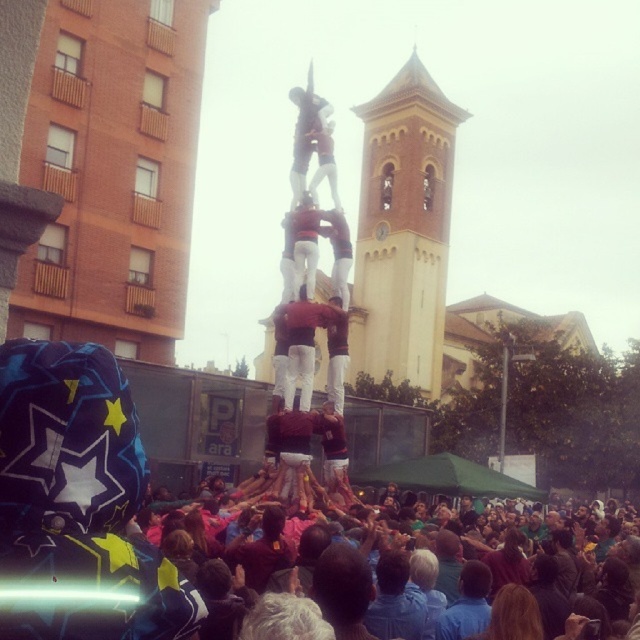
You are a photographer standing in the middle of the scene. You want to take a photo of the yellow brick tower at upper center without the dark blue fabric crowd at lower center blocking it. Which direction should you move to ensure the crowd is out of the frame?

You should move to the right to position yourself so that the dark blue fabric crowd at lower center is no longer blocking the view of the yellow brick tower at upper center, as the crowd is located to the left of the tower.

You are a photographer at the event and want to capture a photo of the yellow brick tower at upper center and the matte red shirt at center. From the photographer perspective, which object is positioned to the right side?

The yellow brick tower at upper center is positioned to the right of the matte red shirt at center.